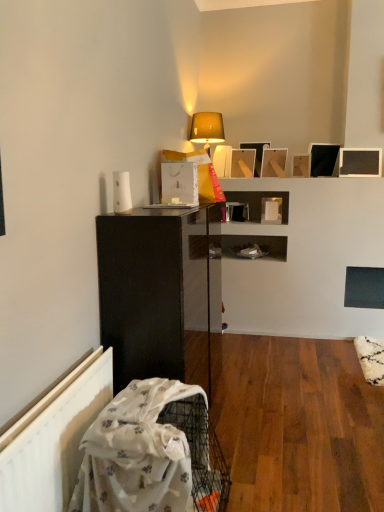
Question: Does white fabric at lower left have a greater height compared to matte beige lampshade at upper center?

Choices:
 (A) no
 (B) yes

Answer: (B)

Question: Is white fabric at lower left wider than matte beige lampshade at upper center?

Choices:
 (A) yes
 (B) no

Answer: (A)

Question: From a real-world perspective, is white fabric at lower left physically above matte beige lampshade at upper center?

Choices:
 (A) yes
 (B) no

Answer: (B)

Question: Considering the relative positions of white fabric at lower left and matte beige lampshade at upper center in the image provided, is white fabric at lower left to the left of matte beige lampshade at upper center from the viewer's perspective?

Choices:
 (A) yes
 (B) no

Answer: (A)

Question: Is matte beige lampshade at upper center completely or partially inside white fabric at lower left?

Choices:
 (A) no
 (B) yes

Answer: (A)

Question: Could you tell me if white fabric at lower left is facing matte beige lampshade at upper center?

Choices:
 (A) yes
 (B) no

Answer: (B)

Question: Is black matte picture frame at upper right, the fifth picture frame viewed from the left, taller than matte black picture frame at upper center, marked as the 3th picture frame in a right-to-left arrangement?

Choices:
 (A) yes
 (B) no

Answer: (A)

Question: Is black matte picture frame at upper right, which is the second picture frame in right-to-left order, not within matte black picture frame at upper center, marked as the 3th picture frame in a right-to-left arrangement?

Choices:
 (A) no
 (B) yes

Answer: (B)

Question: Does black matte picture frame at upper right, the fifth picture frame viewed from the left, lie behind matte black picture frame at upper center, positioned as the fourth picture frame in left-to-right order?

Choices:
 (A) yes
 (B) no

Answer: (A)

Question: Does black matte picture frame at upper right, the fifth picture frame viewed from the left, have a greater width compared to matte black picture frame at upper center, positioned as the fourth picture frame in left-to-right order?

Choices:
 (A) yes
 (B) no

Answer: (B)

Question: Is black matte picture frame at upper right, which is the second picture frame in right-to-left order, smaller than matte black picture frame at upper center, positioned as the fourth picture frame in left-to-right order?

Choices:
 (A) no
 (B) yes

Answer: (A)

Question: From a real-world perspective, is black matte picture frame at upper right, which is the second picture frame in right-to-left order, located beneath matte black picture frame at upper center, positioned as the fourth picture frame in left-to-right order?

Choices:
 (A) no
 (B) yes

Answer: (A)

Question: Is matte wooden picture frame at upper center, marked as the 1th picture frame in a left-to-right arrangement, far away from matte black cabinet at left?

Choices:
 (A) no
 (B) yes

Answer: (B)